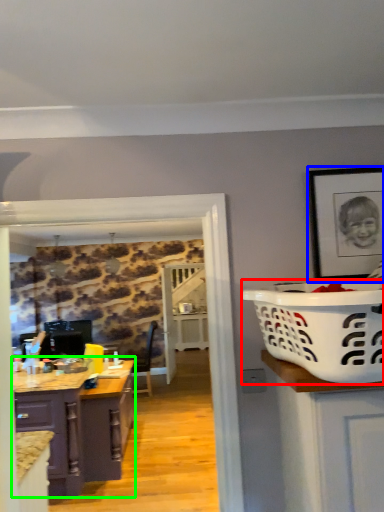
Question: Which is farther away from basket container (highlighted by a red box)? picture frame (highlighted by a blue box) or cabinetry (highlighted by a green box)?

Choices:
 (A) picture frame
 (B) cabinetry

Answer: (B)